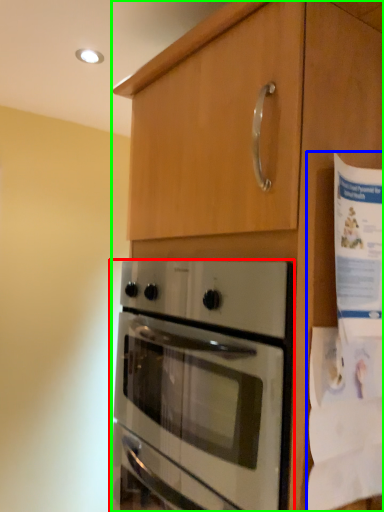
Question: Which object is positioned closest to oven (highlighted by a red box)? Select from paper (highlighted by a blue box) and cabinetry (highlighted by a green box).

Choices:
 (A) paper
 (B) cabinetry

Answer: (B)